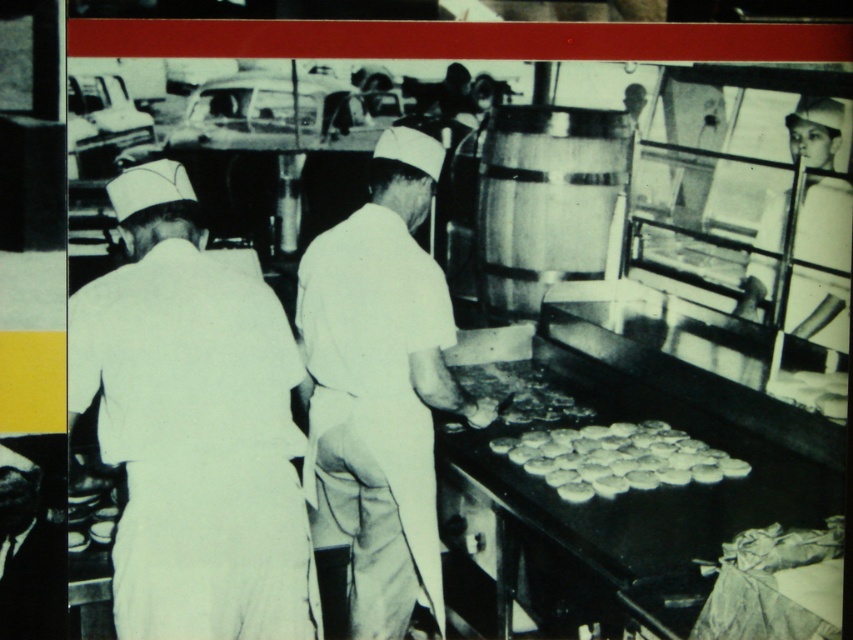
Question: Is white smooth uniform at center behind white uniform at upper right?

Choices:
 (A) yes
 (B) no

Answer: (B)

Question: Which is farther from the white uniform at upper right?

Choices:
 (A) white smooth uniform at center
 (B) white matte cookies at center
 (C) white uniform at left

Answer: (C)

Question: Does white uniform at upper right appear over white matte cookies at center?

Choices:
 (A) no
 (B) yes

Answer: (B)

Question: Which is nearer to the white uniform at left?

Choices:
 (A) white smooth uniform at center
 (B) white matte cookies at center
 (C) crumbly golden bread at center

Answer: (A)

Question: Which point is farther to the camera?

Choices:
 (A) (834, 260)
 (B) (512, 387)
 (C) (556, 470)
 (D) (289, 636)

Answer: (A)

Question: Observing the image, what is the correct spatial positioning of white smooth uniform at center in reference to white matte cookies at center?

Choices:
 (A) left
 (B) right

Answer: (A)